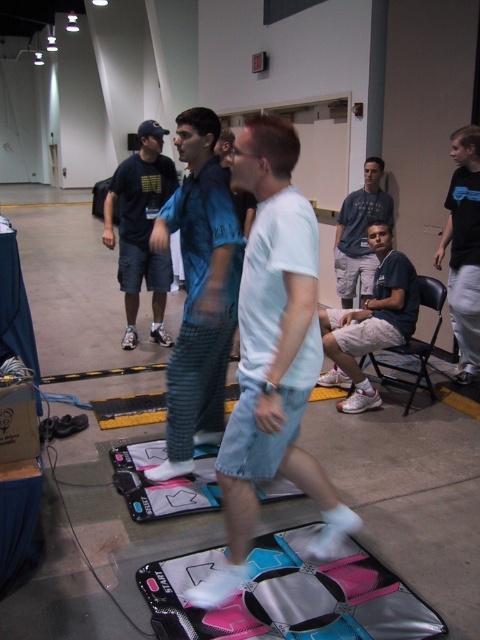
You are a photographer in the room and want to take a photo of the light brown shorts at center and the matte blue shirt at center. Which object should you focus on first if you want to capture both in the same frame without moving the camera?

The light brown shorts at center is positioned on the left side of matte blue shirt at center, so you should focus on the light brown shorts at center first to ensure both are in the frame.

You are a photographer standing at the back of the room. You want to take a photo of the light brown shorts at center and the matte blue shirt at center. Which object will appear larger in your photo?

The light brown shorts at center will appear larger in the photo because it is closer to the viewer than the matte blue shirt at center.